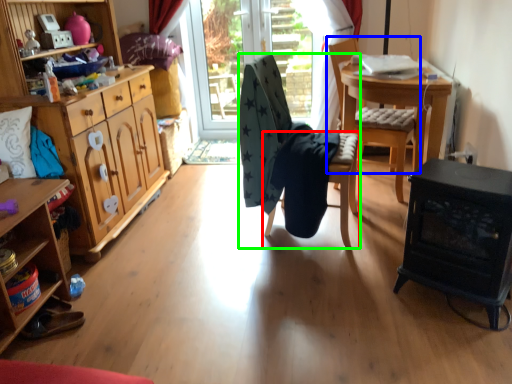
Question: Which object is positioned closest to chair (highlighted by a red box)? Select from chair (highlighted by a blue box) and chair (highlighted by a green box).

Choices:
 (A) chair
 (B) chair

Answer: (B)